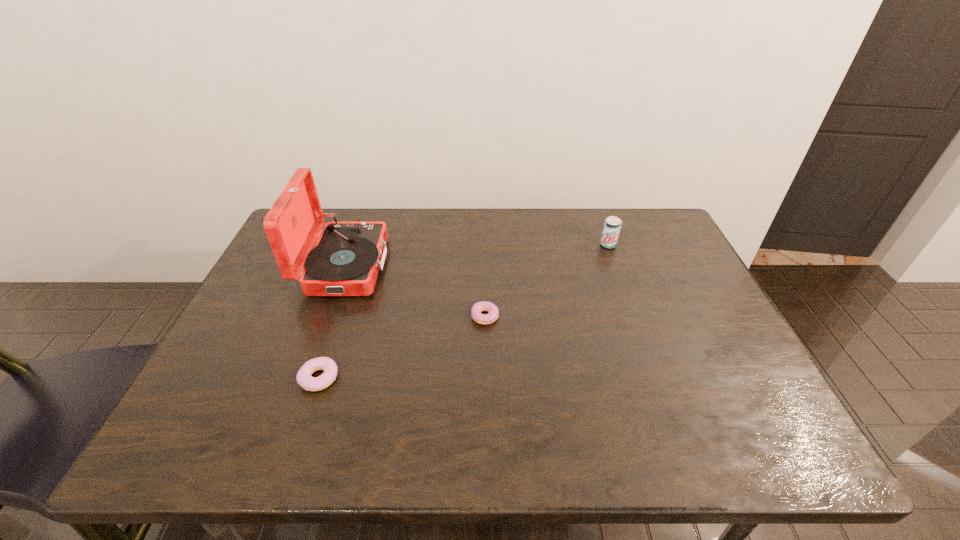
Find the location of a particular element. The width and height of the screenshot is (960, 540). object that stands as the closest to the rightmost object is located at coordinates (478, 307).

Identify the location of the closest object to the second nearest object. (345, 261).

Where is `free spot that satisfies the following two spatial constraints: 1. on the front-facing side of the phonograph_record; 2. on the right side of the nearest object`? This screenshot has width=960, height=540. free spot that satisfies the following two spatial constraints: 1. on the front-facing side of the phonograph_record; 2. on the right side of the nearest object is located at coordinates (304, 378).

What are the coordinates of `free space that satisfies the following two spatial constraints: 1. on the back side of the farther doughnut; 2. on the left side of the nearest object` in the screenshot? It's located at click(340, 316).

Locate an element on the screen. The image size is (960, 540). vacant space that satisfies the following two spatial constraints: 1. on the front-facing side of the tallest object; 2. on the back side of the nearer doughnut is located at coordinates (304, 378).

Where is `blank space that satisfies the following two spatial constraints: 1. on the front-facing side of the tallest object; 2. on the left side of the nearest object`? The image size is (960, 540). blank space that satisfies the following two spatial constraints: 1. on the front-facing side of the tallest object; 2. on the left side of the nearest object is located at coordinates [304, 378].

The image size is (960, 540). I want to click on vacant region that satisfies the following two spatial constraints: 1. on the back side of the shortest object; 2. on the front-facing side of the phonograph_record, so click(487, 266).